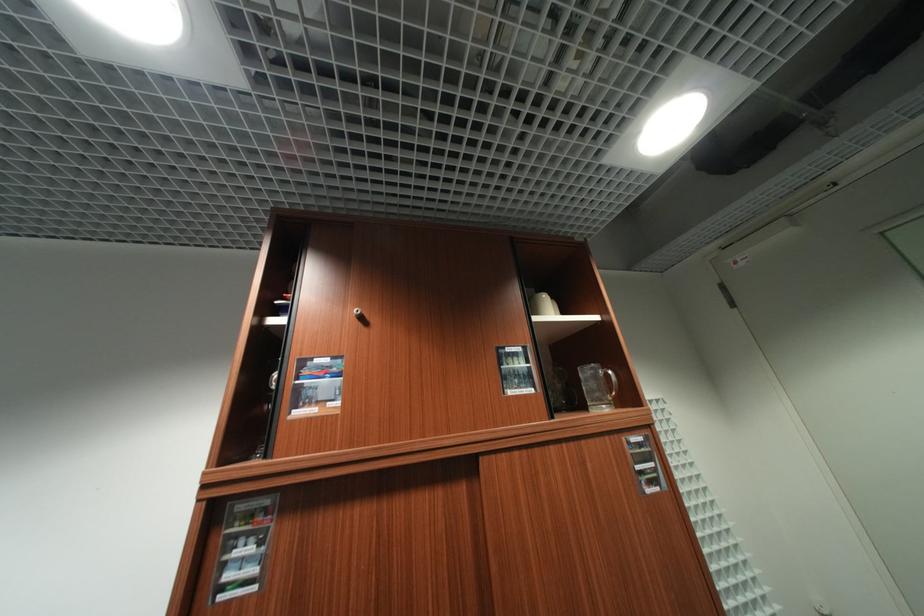
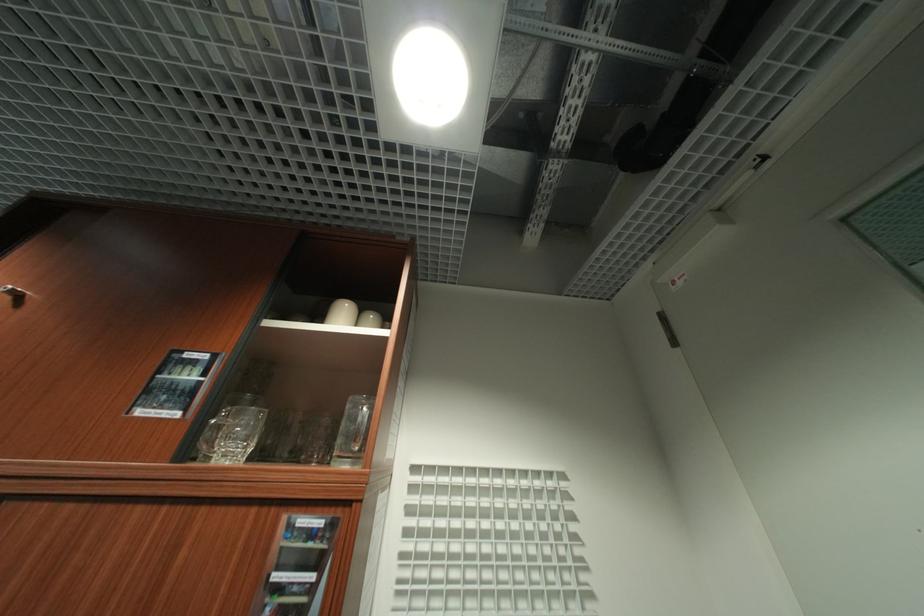
Question: The first image is from the beginning of the video and the second image is from the end. How did the camera likely rotate when shooting the video?

Choices:
 (A) Left
 (B) Right
 (C) Up
 (D) Down

Answer: (A)